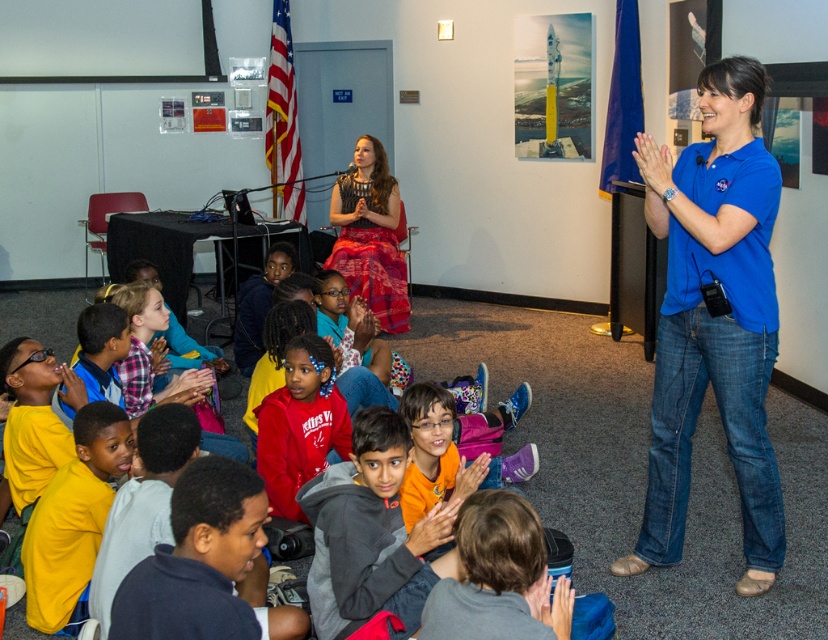
Question: Can you confirm if gray fleece jacket at center is bigger than gray fleece sweater at lower center?

Choices:
 (A) no
 (B) yes

Answer: (B)

Question: Considering the real-world distances, which object is closest to the blue cotton shirt at right?

Choices:
 (A) gray fleece sweater at lower center
 (B) red fleece sweatshirt at center
 (C) dark blue shirt at lower left
 (D) matte red skirt at center

Answer: (A)

Question: Which point is closer to the camera?

Choices:
 (A) click(x=390, y=200)
 (B) click(x=297, y=394)
 (C) click(x=522, y=604)
 (D) click(x=648, y=214)

Answer: (C)

Question: Is gray fleece sweater at lower center to the right of matte red skirt at center from the viewer's perspective?

Choices:
 (A) yes
 (B) no

Answer: (A)

Question: Observing the image, what is the correct spatial positioning of red fleece sweatshirt at center in reference to matte red skirt at center?

Choices:
 (A) left
 (B) right

Answer: (B)

Question: Which of the following is the closest to the observer?

Choices:
 (A) (222, 458)
 (B) (268, 468)
 (C) (728, 124)

Answer: (A)